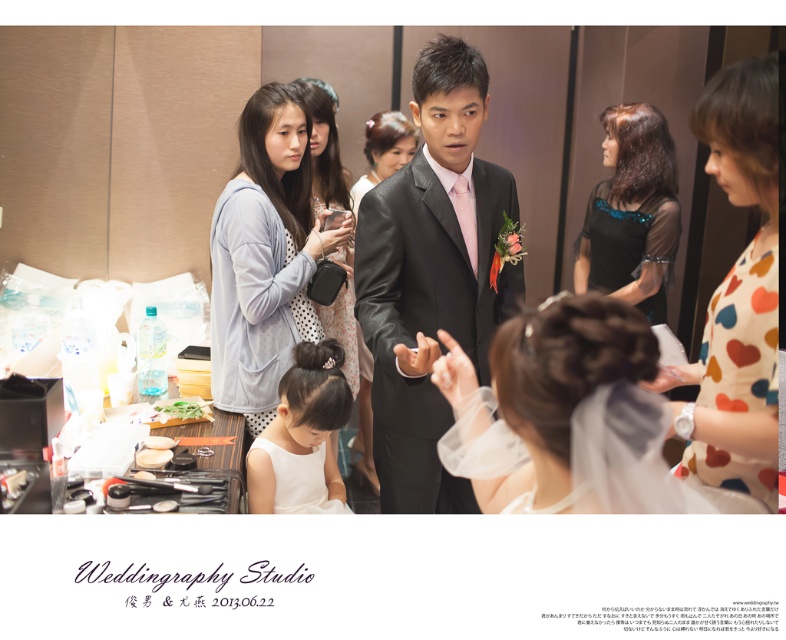
Question: Can you confirm if light blue fabric at center is positioned to the right of satin black dress at center?

Choices:
 (A) yes
 (B) no

Answer: (B)

Question: Estimate the real-world distances between objects in this image. Which object is farther from the white lace veil at center?

Choices:
 (A) polka dot dress at center
 (B) satin black dress at center
 (C) light blue fabric at center
 (D) shiny black dress at center

Answer: (B)

Question: Based on their relative distances, which object is farther from the polka dot dress at center?

Choices:
 (A) shiny black dress at center
 (B) light blue fabric at center
 (C) white lace veil at center

Answer: (A)

Question: Which object is the farthest from the shiny black dress at center?

Choices:
 (A) white lace veil at center
 (B) satin black dress at center

Answer: (A)

Question: Can you confirm if shiny black dress at center is positioned to the left of light gray polka dot dress at center?

Choices:
 (A) yes
 (B) no

Answer: (B)

Question: Can you confirm if shiny black suit at center is wider than white lace veil at center?

Choices:
 (A) no
 (B) yes

Answer: (B)